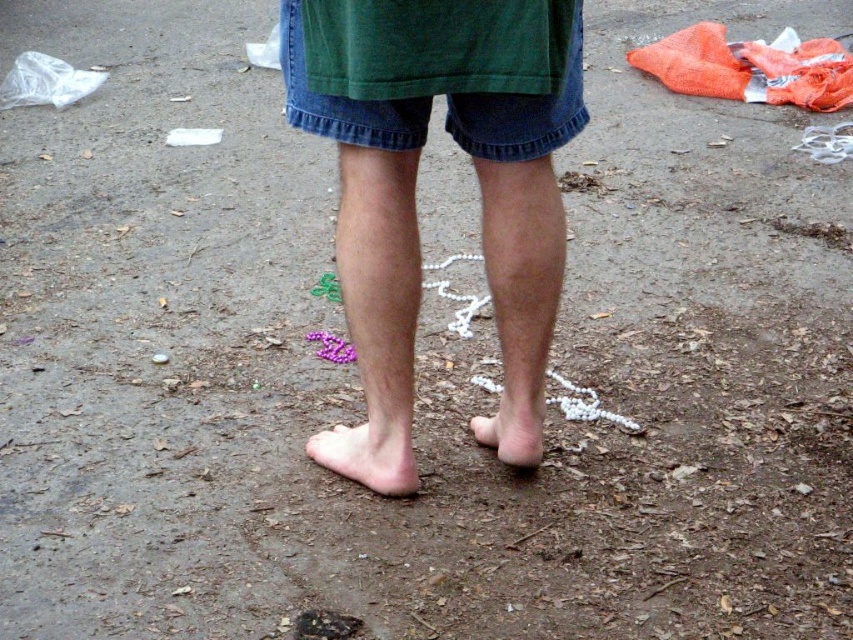
Between smooth skin legs at center and denim shorts at center, which one has less height?

denim shorts at center is shorter.

Is point (357, 308) positioned after point (585, 115)?

Yes, it is behind point (585, 115).

The image size is (853, 640). What do you see at coordinates (369, 262) in the screenshot?
I see `smooth skin legs at center` at bounding box center [369, 262].

Locate an element on the screen. The height and width of the screenshot is (640, 853). smooth skin legs at center is located at coordinates (369, 262).

Which of these two, smooth skin legs at center or pink matte foot at lower center, stands taller?

Standing taller between the two is smooth skin legs at center.

At what (x,y) coordinates should I click in order to perform the action: click on smooth skin legs at center. Please return your answer as a coordinate pair (x, y). This screenshot has width=853, height=640. Looking at the image, I should click on (369, 262).

Locate an element on the screen. The width and height of the screenshot is (853, 640). smooth skin legs at center is located at coordinates (369, 262).

Who is taller, denim shorts at center or pale skin at lower center?

denim shorts at center is taller.

Consider the image. Who is positioned more to the left, denim shorts at center or pale skin at lower center?

Positioned to the left is pale skin at lower center.

Image resolution: width=853 pixels, height=640 pixels. I want to click on denim shorts at center, so click(x=520, y=116).

This screenshot has height=640, width=853. In order to click on denim shorts at center in this screenshot , I will do `click(520, 116)`.